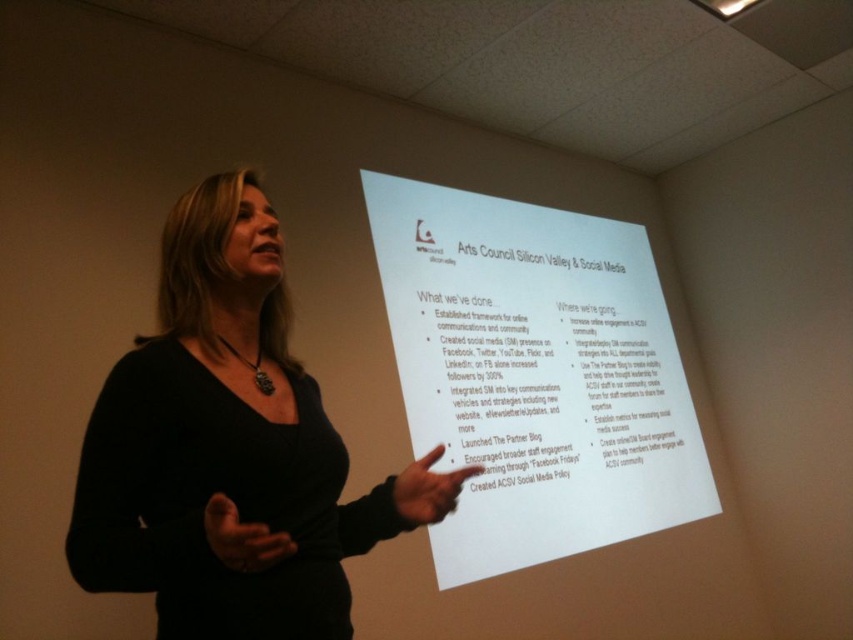
Question: Does white paper at center lie behind black matte dress at center?

Choices:
 (A) no
 (B) yes

Answer: (B)

Question: Which of the following is the farthest from the observer?

Choices:
 (A) black matte dress at center
 (B) white paper at center

Answer: (B)

Question: Is white paper at center to the left of black matte dress at center from the viewer's perspective?

Choices:
 (A) no
 (B) yes

Answer: (A)

Question: Which object is farther from the camera taking this photo?

Choices:
 (A) black matte dress at center
 (B) white paper at center
 (C) white paper at upper center

Answer: (C)

Question: Can you confirm if black matte dress at center is positioned above white paper at upper center?

Choices:
 (A) no
 (B) yes

Answer: (B)

Question: Which object is farther from the camera taking this photo?

Choices:
 (A) white paper at center
 (B) black matte dress at center
 (C) white paper at upper center

Answer: (C)